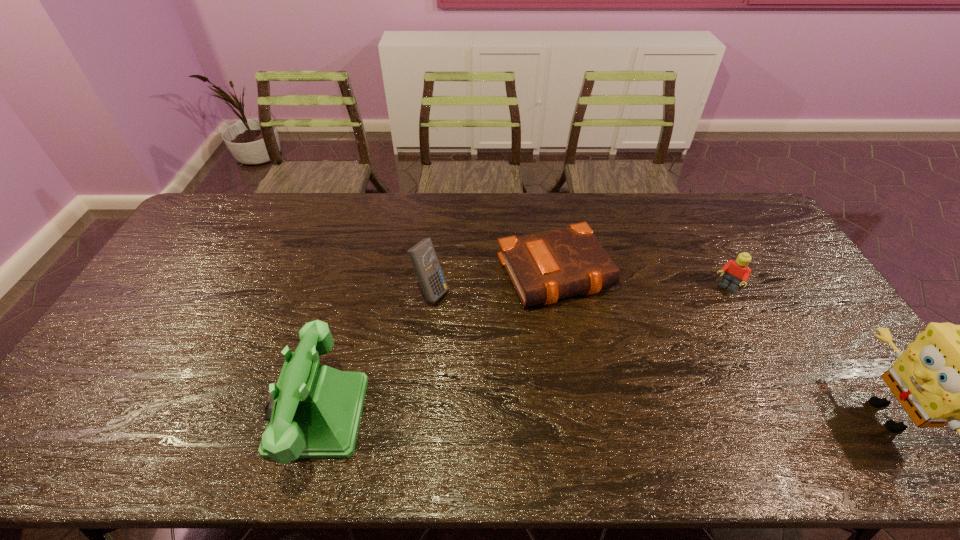
Locate an element on the screen. The image size is (960, 540). vacant space on the desktop that is between the leftmost object and the sponge and is positioned on the front-facing side of the calculator is located at coordinates (653, 415).

This screenshot has width=960, height=540. In order to click on free spot on the desktop that is between the second tallest object and the sponge and is positioned on the face of the second object from right to left in this screenshot , I will do `click(621, 415)`.

Where is `free space on the desktop that is between the telephone and the sponge and is positioned on the spine side of the third object from left to right`? The image size is (960, 540). free space on the desktop that is between the telephone and the sponge and is positioned on the spine side of the third object from left to right is located at coordinates click(x=641, y=415).